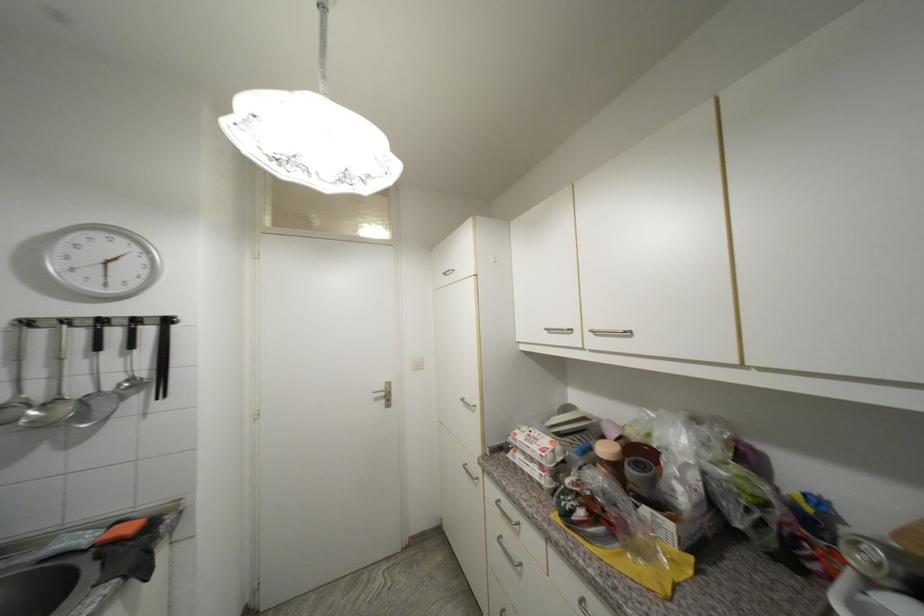
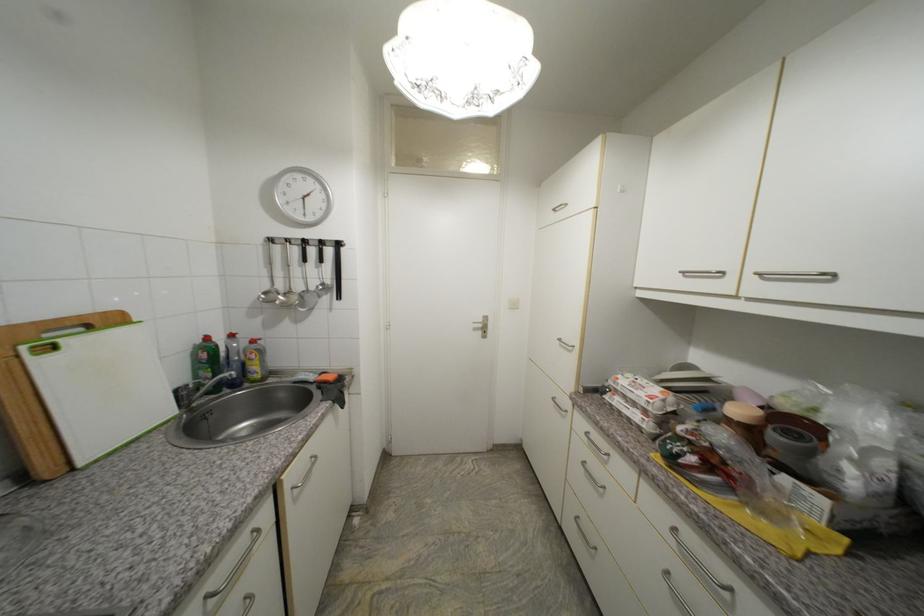
In the second image, find the point that corresponds to (521,463) in the first image.

(619, 405)